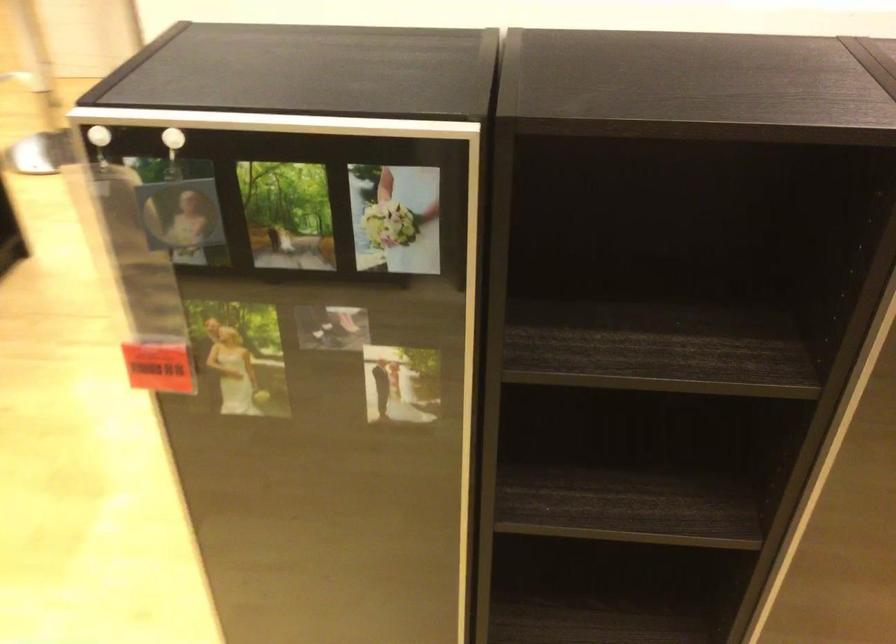
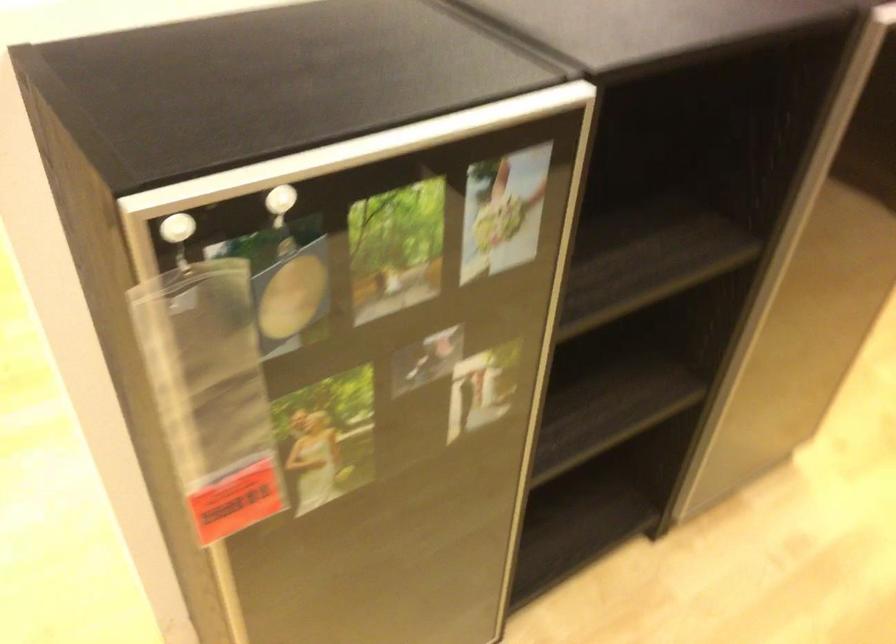
Locate, in the second image, the point that corresponds to point (108, 131) in the first image.

(177, 228)